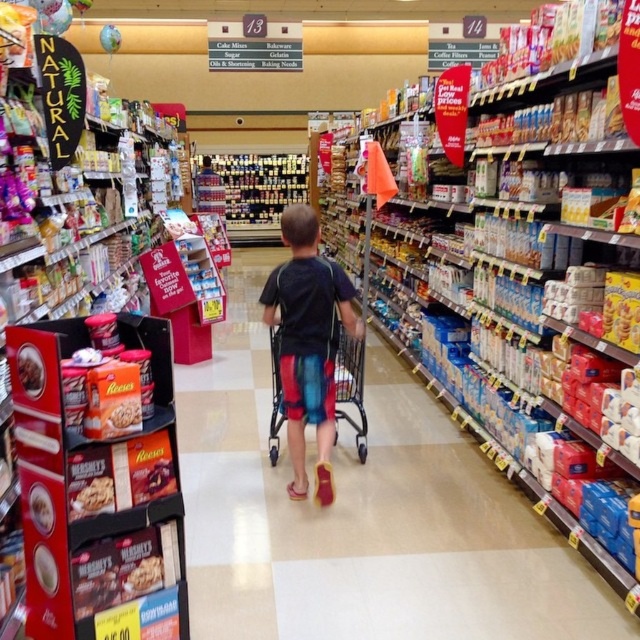
Is point (104, 486) positioned behind point (132, 566)?

That is False.

Who is more forward, (104, 493) or (154, 579)?

Point (104, 493) is in front.

Between point (104, 488) and point (161, 580), which one is positioned behind?

The point (161, 580) is behind.

Identify the location of smooth chocolate bar at lower left. The image size is (640, 640). (93, 497).

Is matte black shirt at center above matte brown peanut butter at center?

Correct, matte black shirt at center is located above matte brown peanut butter at center.

Which is below, matte black shirt at center or matte brown peanut butter at center?

matte brown peanut butter at center is below.

What do you see at coordinates (308, 342) in the screenshot? I see `matte black shirt at center` at bounding box center [308, 342].

Locate an element on the screen. matte black shirt at center is located at coordinates (308, 342).

Is matte black shirt at center smaller than smooth chocolate bar at lower left?

No.

Which is behind, point (280, 280) or point (84, 497)?

The point (280, 280) is more distant.

At what (x,y) coordinates should I click in order to perform the action: click on matte black shirt at center. Please return your answer as a coordinate pair (x, y). Looking at the image, I should click on (308, 342).